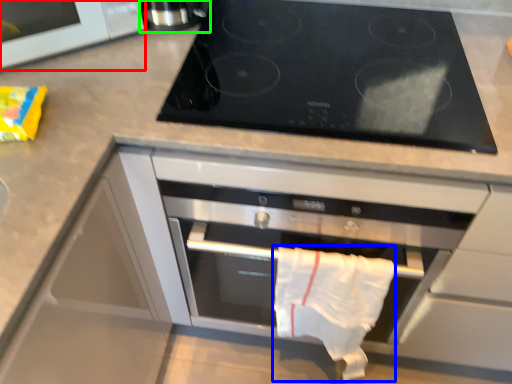
Question: Based on their relative distances, which object is nearer to microwave (highlighted by a red box)? Choose from cloth (highlighted by a blue box) and appliance (highlighted by a green box).

Choices:
 (A) cloth
 (B) appliance

Answer: (B)